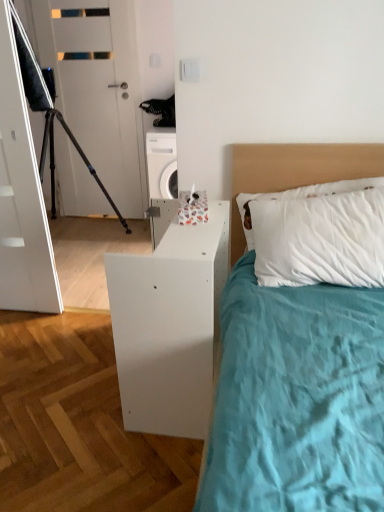
Question: From a real-world perspective, relative to white matte headboard at upper right, is white matte door at upper left vertically above or below?

Choices:
 (A) above
 (B) below

Answer: (A)

Question: In the image, is white matte door at upper left positioned in front of or behind white matte headboard at upper right?

Choices:
 (A) front
 (B) behind

Answer: (B)

Question: Estimate the real-world distances between objects in this image. Which object is farther from the black matte tripod at left?

Choices:
 (A) white matte door at upper left
 (B) white matte headboard at upper right
 (C) white matte nightstand at lower right

Answer: (C)

Question: Which object is the farthest from the black matte tripod at left?

Choices:
 (A) white matte nightstand at lower right
 (B) white matte door at upper left
 (C) white matte headboard at upper right

Answer: (A)